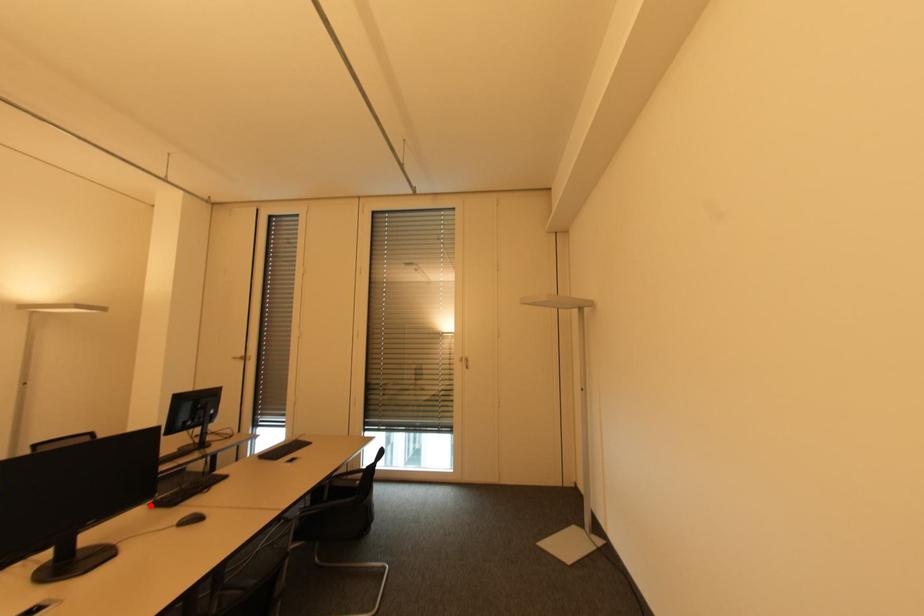
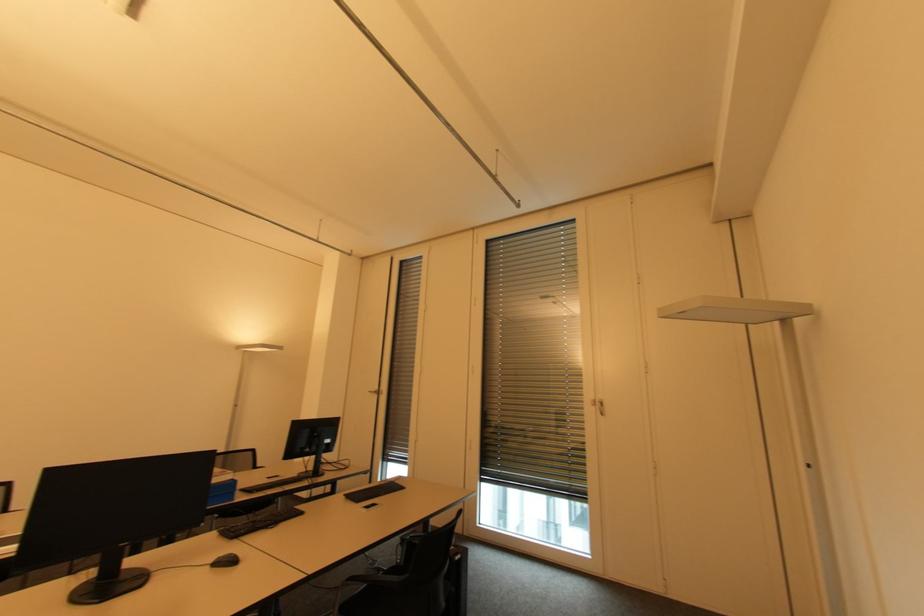
In the second image, find the point that corresponds to the highlighted location in the first image.

(221, 532)